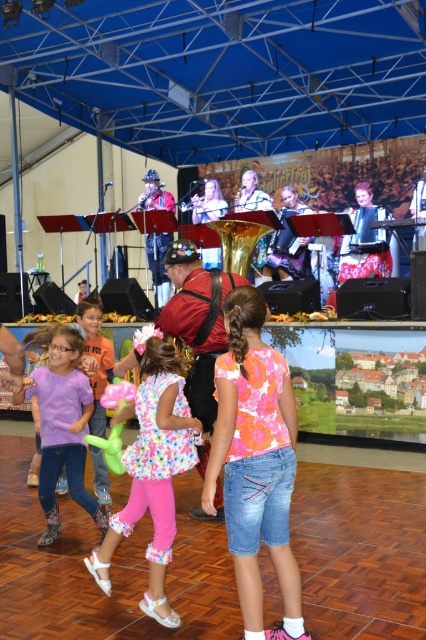
You are standing at the center of the image. Which direction should you move to reach the purple cotton shirt at lower left?

The purple cotton shirt at lower left is located at coordinates approximately 0.662 on the x axis and 0.146 on the y axis. Since you are at the center, moving towards the lower left direction would lead you to the purple cotton shirt at lower left.

Consider the image. You are organizing a photo shoot and want to ensure all participants are visible. Given the floral fabric dress at center and the purple cotton shirt at lower left, which clothing item takes up more space in the image?

The purple cotton shirt at lower left occupies more space than the floral fabric dress at center.